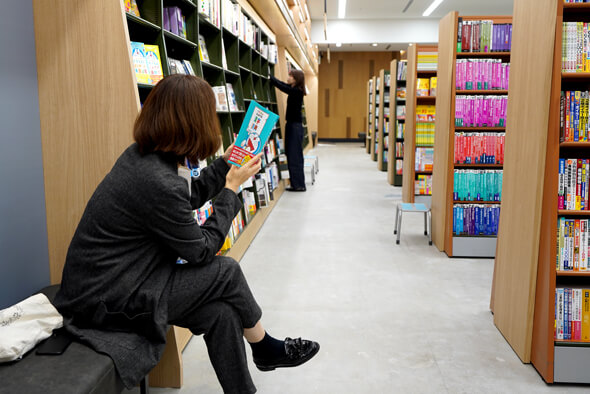
Image resolution: width=590 pixels, height=394 pixels. I want to click on wood paneling, so click(340, 107).